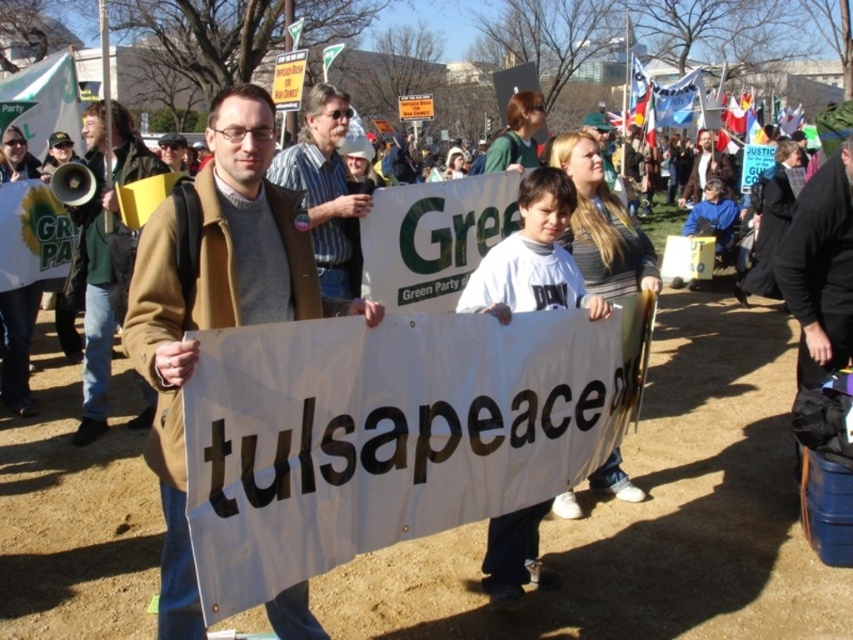
Is black fabric bag at right smaller than striped shirt at center?

Correct, black fabric bag at right occupies less space than striped shirt at center.

Between black fabric bag at right and striped shirt at center, which one appears on the right side from the viewer's perspective?

black fabric bag at right

Identify the location of black fabric bag at right. pos(820,268).

Which is behind, point (149, 380) or point (831, 202)?

Point (831, 202)

You are a GUI agent. You are given a task and a screenshot of the screen. Output one action in this format:
    pyautogui.click(x=<x>, y=<y>)
    Task: Click on the brown wool coat at center
    This screenshot has width=853, height=640.
    Given the screenshot: What is the action you would take?
    pyautogui.click(x=213, y=301)

Which is behind, point (288, 307) or point (843, 342)?

Point (843, 342)

Identify the location of brown wool coat at center. The image size is (853, 640). (213, 301).

Based on the photo, is brown wool coat at center closer to camera compared to striped shirt at center?

Yes.

Does brown wool coat at center appear on the left side of striped shirt at center?

Incorrect, brown wool coat at center is not on the left side of striped shirt at center.

Is point (206, 243) farther from camera compared to point (318, 196)?

That is False.

Locate an element on the screen. The width and height of the screenshot is (853, 640). brown wool coat at center is located at coordinates (213, 301).